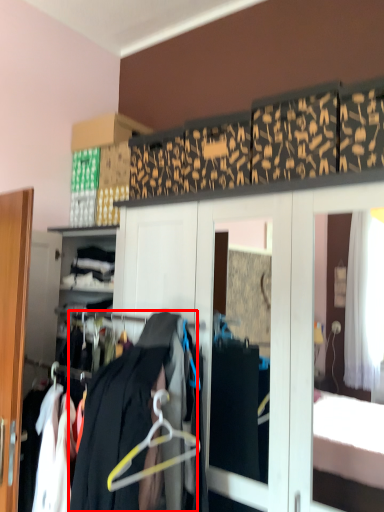
Question: Where is clothing (annotated by the red box) located in relation to hanger in the image?

Choices:
 (A) right
 (B) left

Answer: (B)